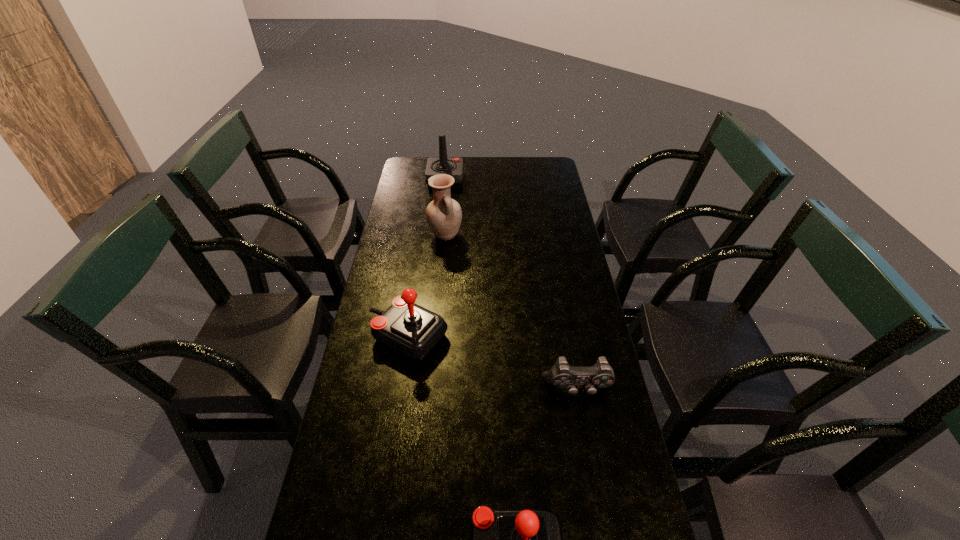
You are a GUI agent. You are given a task and a screenshot of the screen. Output one action in this format:
    pyautogui.click(x=<x>, y=<y>)
    Task: Click on the free point between the farthest object and the shortest object
    The height and width of the screenshot is (540, 960).
    Given the screenshot: What is the action you would take?
    pyautogui.click(x=512, y=285)

At what (x,y) coordinates should I click in order to perform the action: click on free point between the second nearest object and the farthest joystick. Please return your answer as a coordinate pair (x, y). The width and height of the screenshot is (960, 540). Looking at the image, I should click on (512, 285).

Locate which object is the fourth closest to the nearest joystick. Please provide its 2D coordinates. Your answer should be formatted as a tuple, i.e. [(x, y)], where the tuple contains the x and y coordinates of a point satisfying the conditions above.

[(453, 166)]

Where is `the third closest object to the nearest object`? The image size is (960, 540). the third closest object to the nearest object is located at coordinates (444, 215).

The height and width of the screenshot is (540, 960). Identify the location of joystick that stands as the closest to the rightmost joystick. (413, 331).

Identify the location of the closest joystick relative to the second nearest joystick. The image size is (960, 540). (501, 539).

Image resolution: width=960 pixels, height=540 pixels. Find the location of `vacant space that satisfies the following two spatial constraints: 1. on the front-facing side of the pottery; 2. on the right side of the farthest joystick`. vacant space that satisfies the following two spatial constraints: 1. on the front-facing side of the pottery; 2. on the right side of the farthest joystick is located at coordinates (439, 235).

This screenshot has height=540, width=960. In order to click on vacant area in the image that satisfies the following two spatial constraints: 1. on the front-facing side of the farthest object; 2. on the right side of the pottery in this screenshot , I will do `click(439, 235)`.